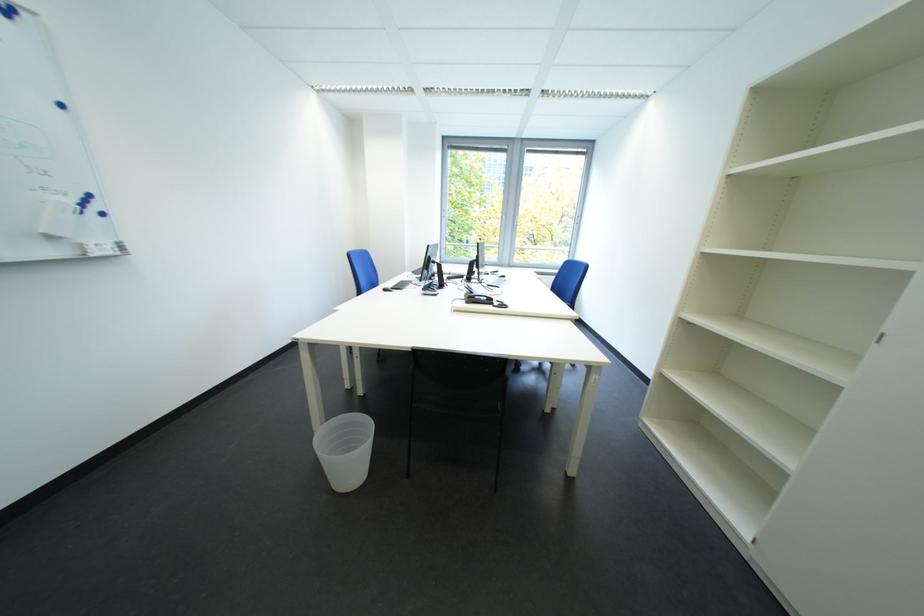
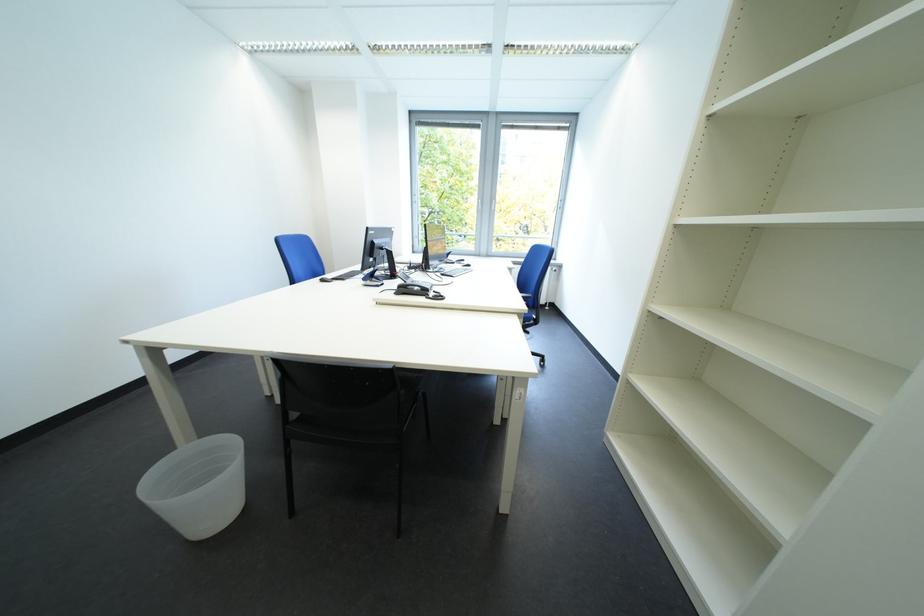
Question: The first image is from the beginning of the video and the second image is from the end. How did the camera likely rotate when shooting the video?

Choices:
 (A) Left
 (B) Right
 (C) Up
 (D) Down

Answer: (D)